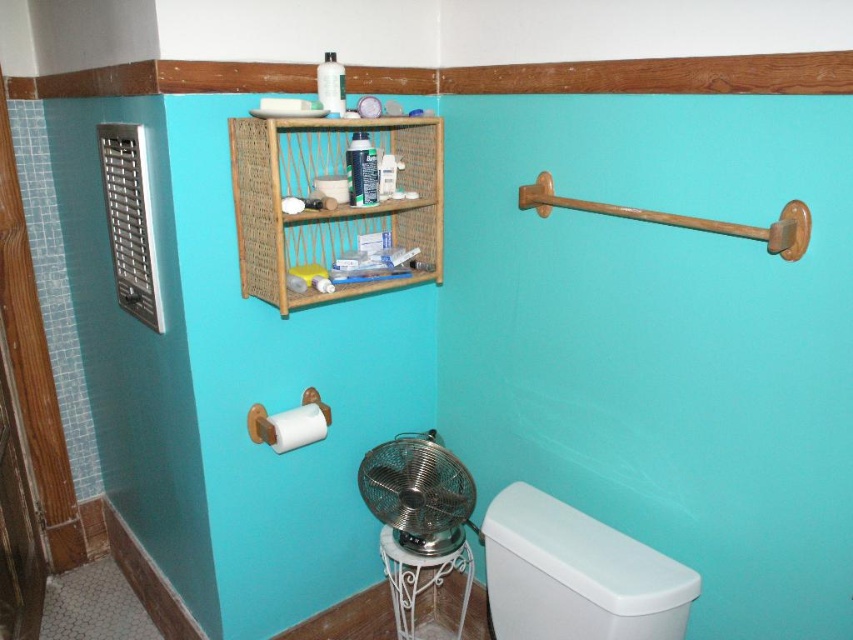
Can you confirm if woven bamboo shelf at upper center is thinner than white plastic toilet at lower right?

No, woven bamboo shelf at upper center is not thinner than white plastic toilet at lower right.

Does woven bamboo shelf at upper center appear under white plastic toilet at lower right?

Incorrect, woven bamboo shelf at upper center is not positioned below white plastic toilet at lower right.

This screenshot has width=853, height=640. What do you see at coordinates (328, 209) in the screenshot?
I see `woven bamboo shelf at upper center` at bounding box center [328, 209].

Locate an element on the screen. woven bamboo shelf at upper center is located at coordinates (328, 209).

Is point (366, 124) positioned behind point (276, 436)?

That is False.

Who is taller, woven bamboo shelf at upper center or white matte toilet paper at lower left?

woven bamboo shelf at upper center

The height and width of the screenshot is (640, 853). I want to click on woven bamboo shelf at upper center, so click(328, 209).

Where is `woven bamboo shelf at upper center`? This screenshot has height=640, width=853. woven bamboo shelf at upper center is located at coordinates (328, 209).

Is woven bamboo shelf at upper center below metallic silver fan at lower center?

No, woven bamboo shelf at upper center is not below metallic silver fan at lower center.

Can you confirm if woven bamboo shelf at upper center is wider than metallic silver fan at lower center?

Yes.

Identify the location of woven bamboo shelf at upper center. (328, 209).

What are the coordinates of `woven bamboo shelf at upper center` in the screenshot? It's located at (328, 209).